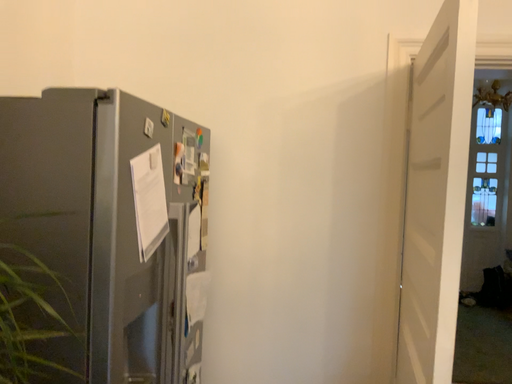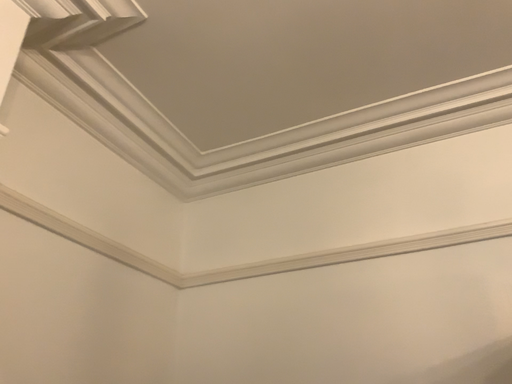
Question: Which way did the camera rotate in the video?

Choices:
 (A) rotated left
 (B) rotated right

Answer: (A)